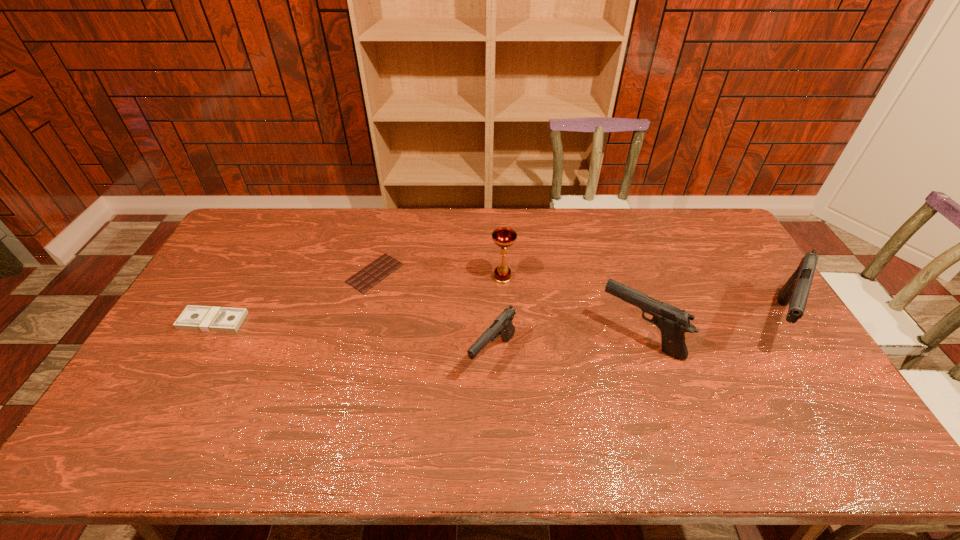
At what (x,y) coordinates should I click in order to perform the action: click on free spot between the chalice and the second shortest object. Please return your answer as a coordinate pair (x, y). Looking at the image, I should click on (358, 299).

You are a GUI agent. You are given a task and a screenshot of the screen. Output one action in this format:
    pyautogui.click(x=<x>, y=<y>)
    Task: Click on the empty space between the second shortest gun and the second object from left to right
    This screenshot has width=960, height=540.
    Given the screenshot: What is the action you would take?
    pyautogui.click(x=507, y=305)

The image size is (960, 540). I want to click on free area in between the dollar and the third shortest object, so click(353, 338).

You are a GUI agent. You are given a task and a screenshot of the screen. Output one action in this format:
    pyautogui.click(x=<x>, y=<y>)
    Task: Click on the empty location between the shortest object and the leftmost object
    
    Given the screenshot: What is the action you would take?
    pyautogui.click(x=294, y=297)

This screenshot has width=960, height=540. I want to click on free space between the fifth object from right to left and the rightmost object, so click(x=575, y=297).

Locate an element on the screen. Image resolution: width=960 pixels, height=540 pixels. empty space that is in between the second object from left to right and the dollar is located at coordinates (294, 297).

Locate which object is the fifth closest to the shortest object. Please provide its 2D coordinates. Your answer should be formatted as a tuple, i.e. [(x, y)], where the tuple contains the x and y coordinates of a point satisfying the conditions above.

[(795, 292)]

Locate an element on the screen. object that stands as the fourth closest to the rightmost object is located at coordinates (372, 274).

What are the coordinates of `the closest gun relative to the leftmost gun` in the screenshot? It's located at (673, 322).

Locate which gun is the third closest to the chocolate bar. Please provide its 2D coordinates. Your answer should be formatted as a tuple, i.e. [(x, y)], where the tuple contains the x and y coordinates of a point satisfying the conditions above.

[(795, 292)]